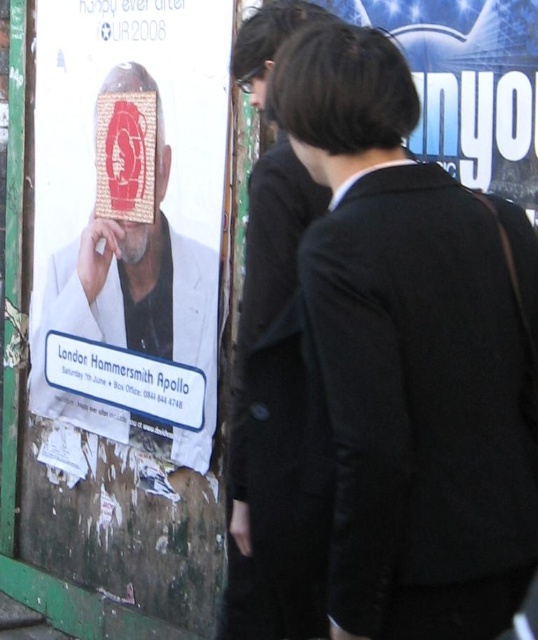
Question: Does black woolen coat at center have a greater width compared to matte black suit at center?

Choices:
 (A) yes
 (B) no

Answer: (A)

Question: Is white paper poster at left thinner than matte black suit at center?

Choices:
 (A) yes
 (B) no

Answer: (B)

Question: Does black woolen coat at center appear on the left side of white paper poster at left?

Choices:
 (A) no
 (B) yes

Answer: (A)

Question: Considering the real-world distances, which object is closest to the black woolen coat at center?

Choices:
 (A) matte black suit at center
 (B) white paper poster at left

Answer: (A)

Question: Among these points, which one is nearest to the camera?

Choices:
 (A) (160, 326)
 (B) (507, 333)
 (C) (278, 170)

Answer: (B)

Question: Which point is farther to the camera?

Choices:
 (A) black woolen coat at center
 (B) white paper poster at left
 (C) matte black suit at center

Answer: (B)